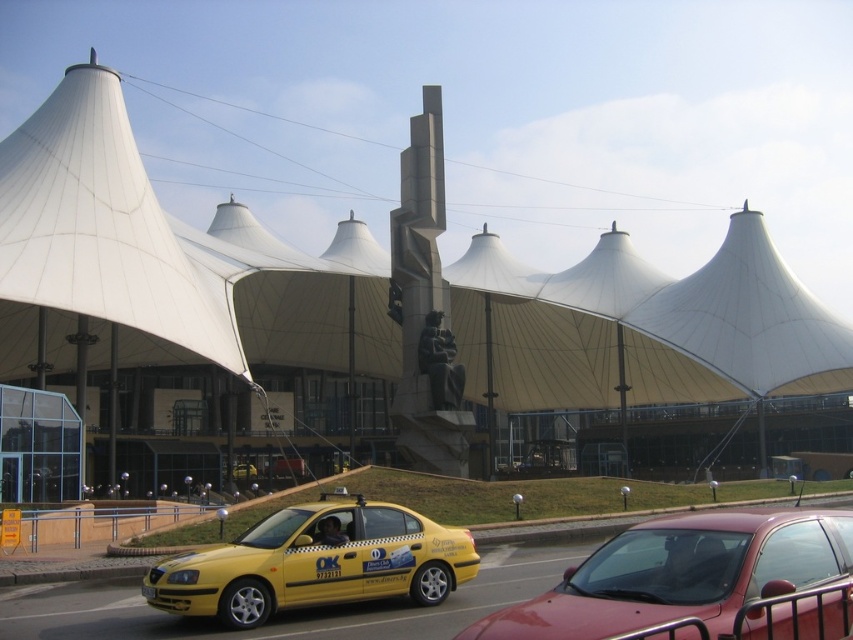
You are a photographer trying to capture a clear shot of the yellow plastic license plate at center without any obstructions. Given the presence of the white fabric canopy at upper left, can you adjust your position to avoid the canopy blocking the license plate?

The yellow plastic license plate at center is behind the white fabric canopy at upper left, so moving your position to the side or lower angle might allow you to capture the license plate without the canopy blocking it.

You are a visitor at this modern architectural site and want to take a photo of the yellow plastic license plate at center without the white fabric canopy at upper left blocking the view. Which direction should you move to ensure the canopy is out of frame?

Move to the right side so that the yellow plastic license plate at center remains in view while the white fabric canopy at upper left moves out of the frame.